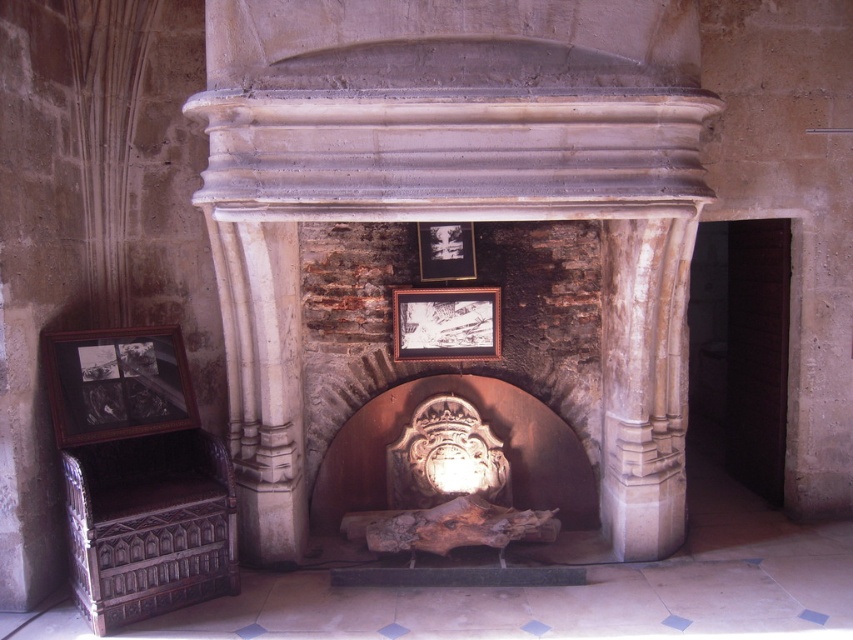
You are an interior designer planning to hang a new decorative item in the space. You see the carved stone fireplace at center and the black matte picture frame at center. Which object is located higher up in the image?

The black matte picture frame at center is higher up than the carved stone fireplace at center, so the black matte picture frame at center is located higher up in the image.